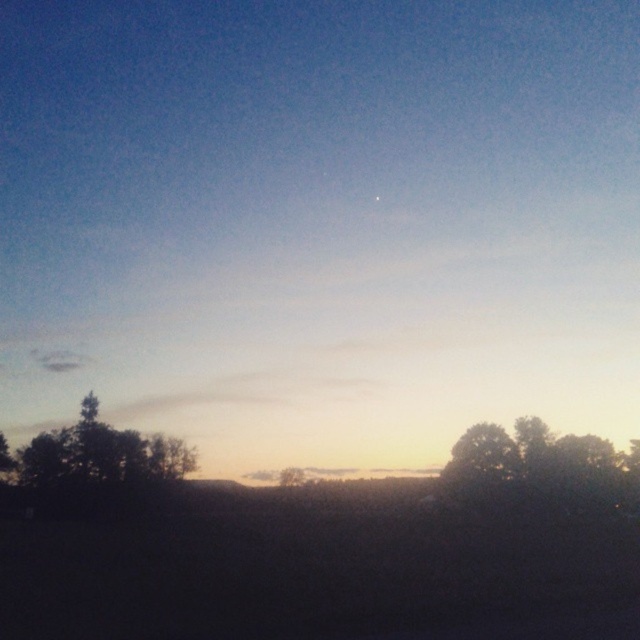
You are standing in the landscape scene and want to walk from the point closer to you to the point further away. Which path would you take between the two points, point (486, 445) and point (278, 481)?

You should walk towards point (278, 481) because point (486, 445) is closer to you, so the further point is (278, 481).

You are standing in a field and see the green leafy tree at lower right in the distance. If you want to reach the tree within 2 minutes, what is the minimum average speed you need to maintain?

The distance between you and the green leafy tree at lower right is 70.28 meters. To cover this distance in 2 minutes, you need to maintain an average speed of approximately 0.585 meters per second, calculated by dividing 70.28 meters by 120 seconds.

You are an artist trying to paint this landscape. You want to ensure the green leafy tree at lower right and the green matte tree at left are proportionally accurate. Which tree should you make wider in your painting?

The green leafy tree at lower right should be painted wider than the green matte tree at left because its width is larger according to the description.